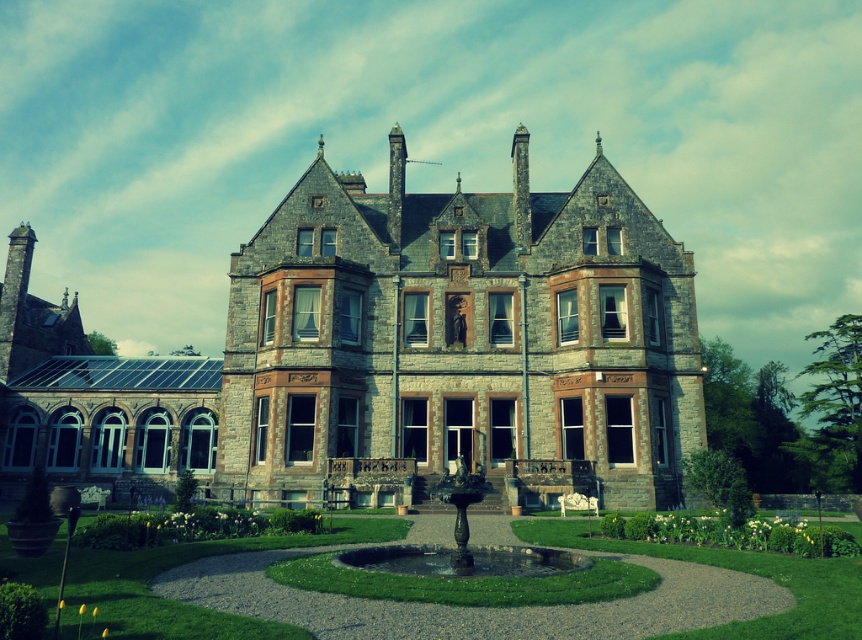
Question: Which of these objects is positioned farthest from the green grass at center?

Choices:
 (A) stone mansion at center
 (B) black stone fountain at center

Answer: (A)

Question: Does green grass at center have a larger size compared to black stone fountain at center?

Choices:
 (A) yes
 (B) no

Answer: (A)

Question: Does green grass at center appear under black stone fountain at center?

Choices:
 (A) yes
 (B) no

Answer: (A)

Question: Which point is closer to the camera?

Choices:
 (A) (525, 570)
 (B) (272, 269)
 (C) (161, 637)

Answer: (C)

Question: Which of these objects is positioned closest to the green grass at center?

Choices:
 (A) stone mansion at center
 (B) black stone fountain at center

Answer: (B)

Question: Is stone mansion at center below green grass at center?

Choices:
 (A) yes
 (B) no

Answer: (B)